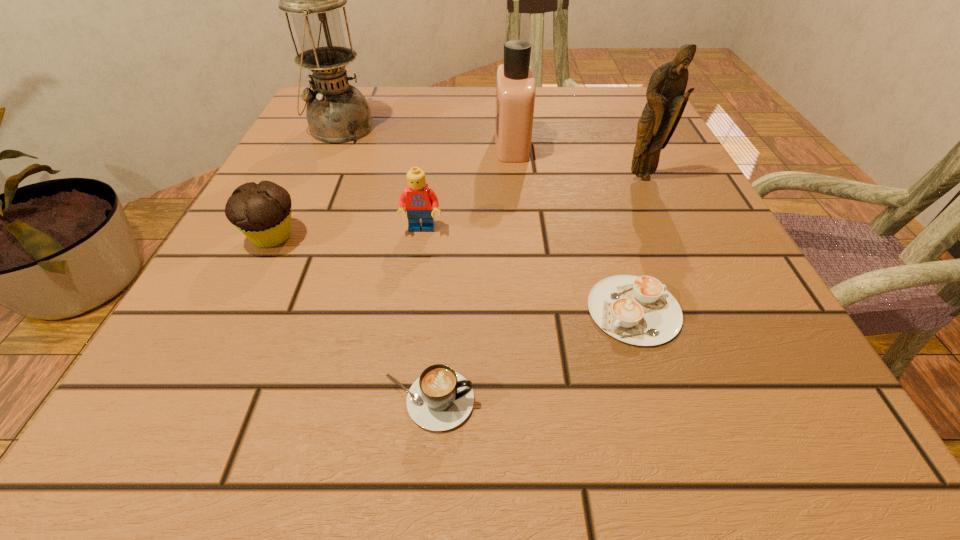
At what (x,y) coordinates should I click in order to perform the action: click on the tallest object. Please return your answer as a coordinate pair (x, y). The width and height of the screenshot is (960, 540). Looking at the image, I should click on (337, 112).

The width and height of the screenshot is (960, 540). I want to click on the sixth shortest object, so click(666, 99).

The image size is (960, 540). Find the location of `figurine`. figurine is located at coordinates (666, 99).

Find the location of `the third object from right to left`. the third object from right to left is located at coordinates (515, 83).

You are a GUI agent. You are given a task and a screenshot of the screen. Output one action in this format:
    pyautogui.click(x=<x>, y=<y>)
    Task: Click on the perfume
    The image size is (960, 540).
    Given the screenshot: What is the action you would take?
    pyautogui.click(x=515, y=83)

You are a GUI agent. You are given a task and a screenshot of the screen. Output one action in this format:
    pyautogui.click(x=<x>, y=<y>)
    Task: Click on the fourth tallest object
    This screenshot has height=540, width=960.
    Given the screenshot: What is the action you would take?
    coord(420,201)

Locate an element on the screen. The height and width of the screenshot is (540, 960). muffin is located at coordinates (262, 212).

Locate an element on the screen. This screenshot has height=540, width=960. the nearer cappuccino is located at coordinates (440, 399).

The width and height of the screenshot is (960, 540). What are the coordinates of `the second shortest object` in the screenshot? It's located at (440, 399).

What are the coordinates of `the shortest object` in the screenshot? It's located at (640, 311).